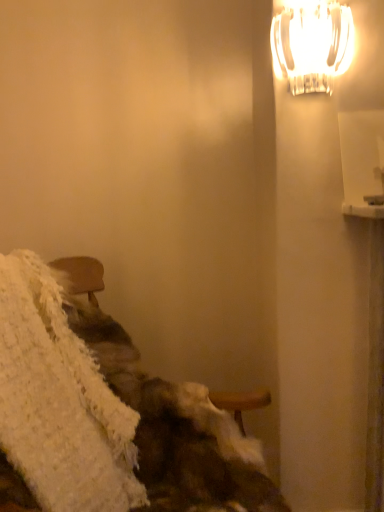
Question: From a real-world perspective, is white frosted glass lamp at upper right physically below white fluffy blanket at lower left?

Choices:
 (A) no
 (B) yes

Answer: (A)

Question: Is white frosted glass lamp at upper right wider than white fluffy blanket at lower left?

Choices:
 (A) yes
 (B) no

Answer: (B)

Question: Would you say white frosted glass lamp at upper right is outside white fluffy blanket at lower left?

Choices:
 (A) no
 (B) yes

Answer: (B)

Question: From the image's perspective, is white frosted glass lamp at upper right located beneath white fluffy blanket at lower left?

Choices:
 (A) no
 (B) yes

Answer: (A)

Question: Considering the relative sizes of white frosted glass lamp at upper right and white fluffy blanket at lower left in the image provided, is white frosted glass lamp at upper right shorter than white fluffy blanket at lower left?

Choices:
 (A) yes
 (B) no

Answer: (A)

Question: Could you tell me if white frosted glass lamp at upper right is facing white fluffy blanket at lower left?

Choices:
 (A) no
 (B) yes

Answer: (A)

Question: Is white fluffy blanket at lower left closer to camera compared to white frosted glass lamp at upper right?

Choices:
 (A) no
 (B) yes

Answer: (B)

Question: From a real-world perspective, is white fluffy blanket at lower left on white frosted glass lamp at upper right?

Choices:
 (A) no
 (B) yes

Answer: (A)

Question: Can you confirm if white fluffy blanket at lower left is wider than white frosted glass lamp at upper right?

Choices:
 (A) no
 (B) yes

Answer: (B)

Question: Is white fluffy blanket at lower left aimed at white frosted glass lamp at upper right?

Choices:
 (A) yes
 (B) no

Answer: (B)

Question: Would you say white fluffy blanket at lower left is a long distance from white frosted glass lamp at upper right?

Choices:
 (A) yes
 (B) no

Answer: (B)

Question: Can you see white fluffy blanket at lower left touching white frosted glass lamp at upper right?

Choices:
 (A) no
 (B) yes

Answer: (A)

Question: In terms of width, does white frosted glass lamp at upper right look wider or thinner when compared to white fluffy blanket at lower left?

Choices:
 (A) wide
 (B) thin

Answer: (B)